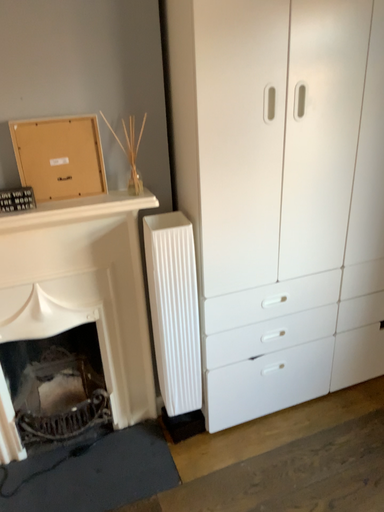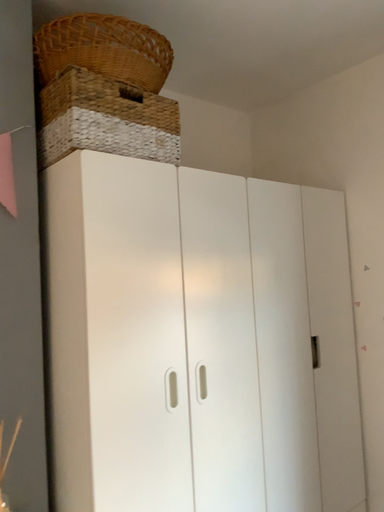
Question: How did the camera likely rotate when shooting the video?

Choices:
 (A) rotated left
 (B) rotated right

Answer: (B)